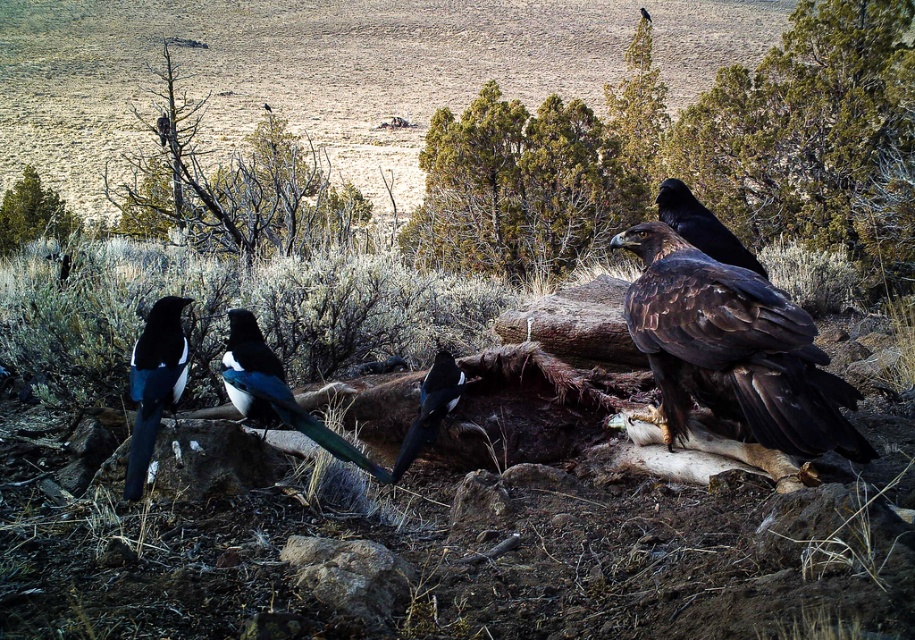
Find the location of a particular element. This screenshot has width=915, height=640. shiny brown vulture at center is located at coordinates (275, 392).

Is shiny brown vulture at center positioned behind shiny black vulture at upper right?

No.

Which is behind, point (272, 387) or point (761, 268)?

Positioned behind is point (761, 268).

The image size is (915, 640). In order to click on shiny brown vulture at center in this screenshot , I will do `click(275, 392)`.

Who is more distant from viewer, [795,307] or [198,209]?

Answer: Positioned behind is point [198,209].

Is point (752, 348) positioned in front of point (278, 211)?

Yes, it is in front of point (278, 211).

In order to click on shiny brown eagle at center right in this screenshot , I will do `click(733, 349)`.

Identify the location of shiny brown eagle at center right. (733, 349).

Locate an element on the screen. The height and width of the screenshot is (640, 915). shiny brown eagle at center right is located at coordinates (733, 349).